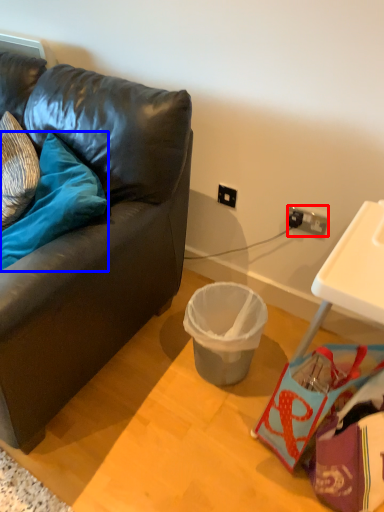
Question: Which object appears closest to the camera in this image, power outlet (highlighted by a red box) or pillow (highlighted by a blue box)?

Choices:
 (A) power outlet
 (B) pillow

Answer: (B)